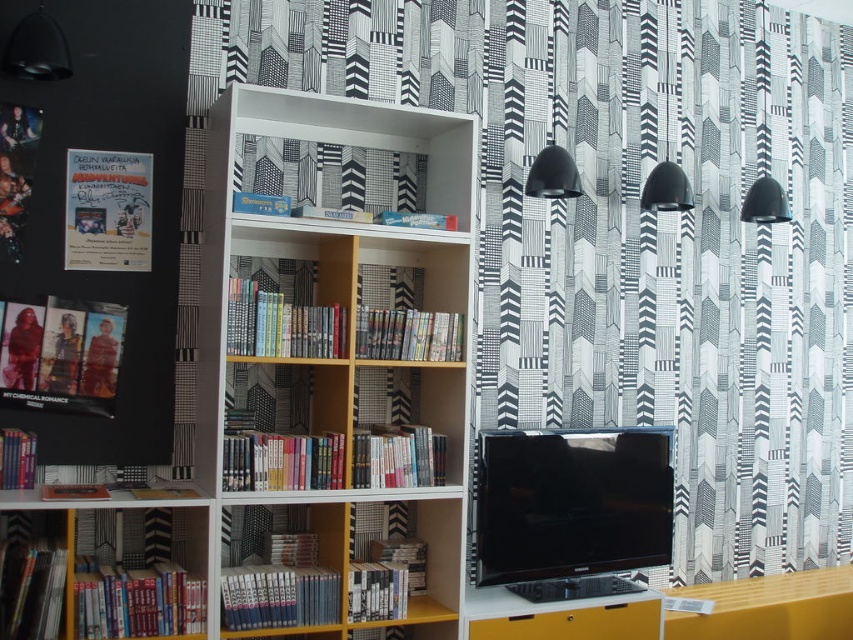
You are standing in the room and want to hang a new painting. The current black and white patterned curtain at upper center is in the way. Where should you place the painting to avoid covering the curtain?

The black and white patterned curtain at upper center is located at point (627, 228), so you should place the painting either to the left or right of that coordinate to avoid covering it.

You are standing in the room and want to know which object is wider between the black and white patterned curtain at upper center and the white wood bookshelf at center. Can you determine this?

The black and white patterned curtain at upper center is wider than the white wood bookshelf at center according to the description.

Consider the image. You are a delivery person who needs to place a 24 inch wide package between the black and white patterned curtain at upper center and the white wood bookshelf at center. Can the package fit in the space between them?

The black and white patterned curtain at upper center is 25.44 inches away from the white wood bookshelf at center. Since the package is 24 inches wide, it can fit in the space between them as the distance is slightly larger than the package width.